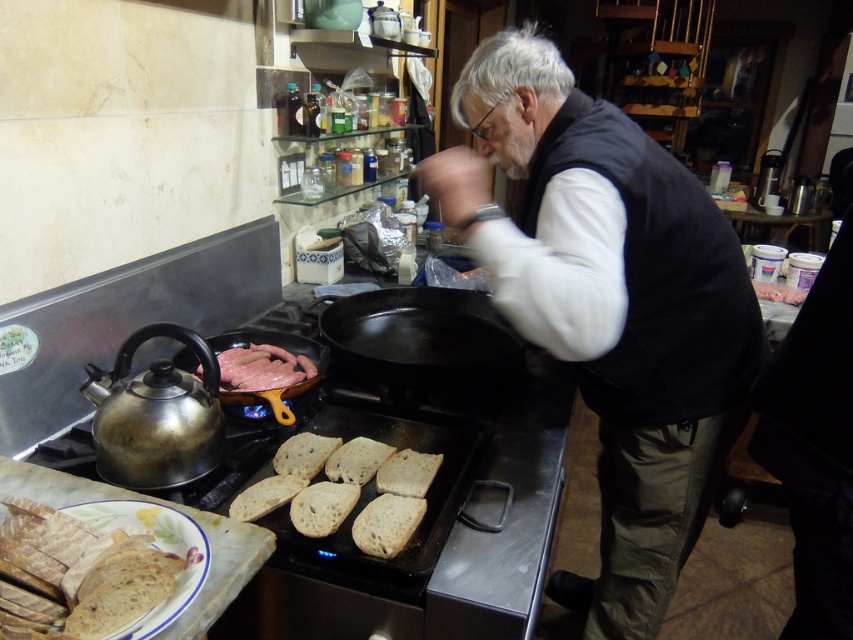
Question: Estimate the real-world distances between objects in this image. Which object is farther from the shiny silver frying pan at lower left?

Choices:
 (A) brown crusty bread at center
 (B) black cast iron frying pan at center

Answer: (A)

Question: Is black cast iron frying pan at center further to the viewer compared to brown crusty bread at center?

Choices:
 (A) no
 (B) yes

Answer: (B)

Question: Which point appears farthest from the camera in this image?

Choices:
 (A) tap(109, 616)
 (B) tap(689, 442)
 (C) tap(335, 349)

Answer: (C)

Question: Can you confirm if shiny metallic kettle at left is positioned to the right of brown crusty bread at center?

Choices:
 (A) yes
 (B) no

Answer: (B)

Question: Does black matte vest at center appear on the left side of brown crusty bread at lower left?

Choices:
 (A) no
 (B) yes

Answer: (A)

Question: Which object appears farthest from the camera in this image?

Choices:
 (A) black cast iron frying pan at center
 (B) brown crusty bread at lower left
 (C) pink raw meat at center
 (D) brown crusty bread at center

Answer: (A)